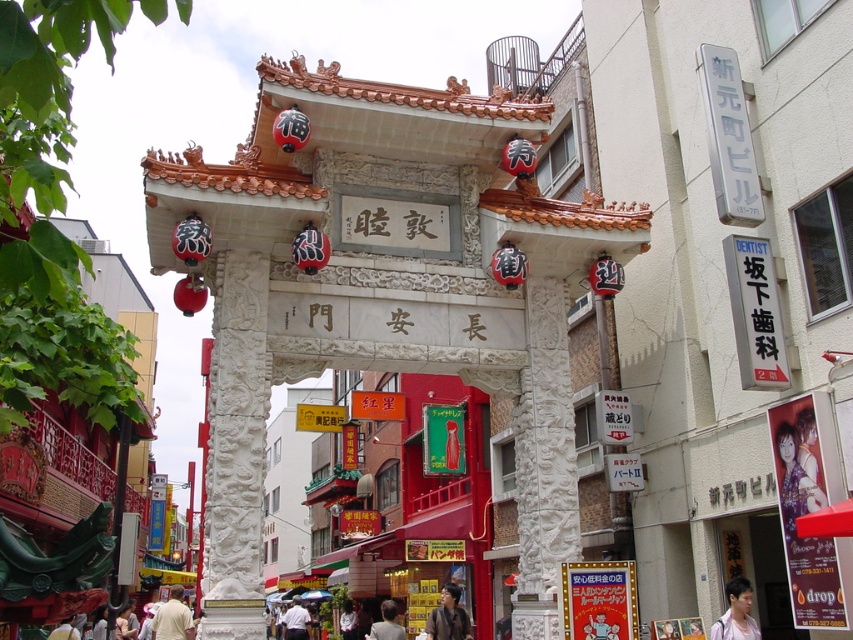
Does matte purple shirt at lower right have a lesser height compared to light brown hair at center?

Indeed, matte purple shirt at lower right has a lesser height compared to light brown hair at center.

Between point (734, 604) and point (386, 609), which one is positioned in front?

Point (734, 604) is in front.

The width and height of the screenshot is (853, 640). Identify the location of matte purple shirt at lower right. (735, 612).

Consider the image. Is matte purple shirt at lower right shorter than light beige shirt at lower center?

Yes, matte purple shirt at lower right is shorter than light beige shirt at lower center.

This screenshot has width=853, height=640. What do you see at coordinates (735, 612) in the screenshot?
I see `matte purple shirt at lower right` at bounding box center [735, 612].

Which is behind, point (752, 637) or point (177, 636)?

Positioned behind is point (177, 636).

Locate an element on the screen. matte purple shirt at lower right is located at coordinates (735, 612).

Can you confirm if smooth black hair at center is shorter than light beige shirt at lower center?

Yes.

Is smooth black hair at center thinner than light beige shirt at lower center?

Correct, smooth black hair at center's width is less than light beige shirt at lower center's.

Between point (440, 618) and point (155, 612), which one is positioned in front?

Point (440, 618) is more forward.

The height and width of the screenshot is (640, 853). In order to click on smooth black hair at center in this screenshot , I will do `click(448, 616)`.